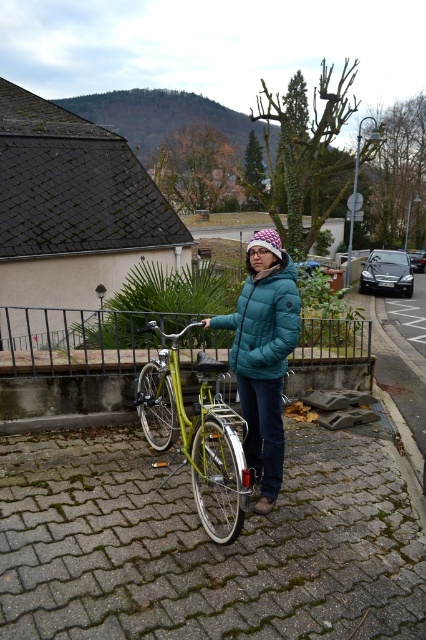
Question: Is green matte bicycle at center wider than teal down jacket at center?

Choices:
 (A) no
 (B) yes

Answer: (B)

Question: In this image, where is green matte bicycle at center located relative to teal down jacket at center?

Choices:
 (A) left
 (B) right

Answer: (A)

Question: Which of the following is the closest to the observer?

Choices:
 (A) (236, 333)
 (B) (222, 488)
 (C) (241, 330)

Answer: (C)

Question: Which object is positioned closest to the teal quilted jacket at center?

Choices:
 (A) green matte bicycle at center
 (B) teal down jacket at center

Answer: (B)

Question: Does teal quilted jacket at center have a lesser width compared to green matte bicycle at center?

Choices:
 (A) yes
 (B) no

Answer: (A)

Question: Based on their relative distances, which object is farther from the teal down jacket at center?

Choices:
 (A) teal quilted jacket at center
 (B) green matte bicycle at center

Answer: (B)